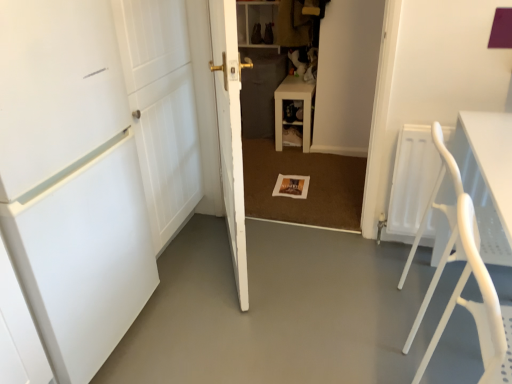
You are a GUI agent. You are given a task and a screenshot of the screen. Output one action in this format:
    pyautogui.click(x=<x>, y=<y>)
    Task: Click on the vacant area located to the right-hand side of white matte door at center, the 1th door from the right
    
    Given the screenshot: What is the action you would take?
    pyautogui.click(x=303, y=267)